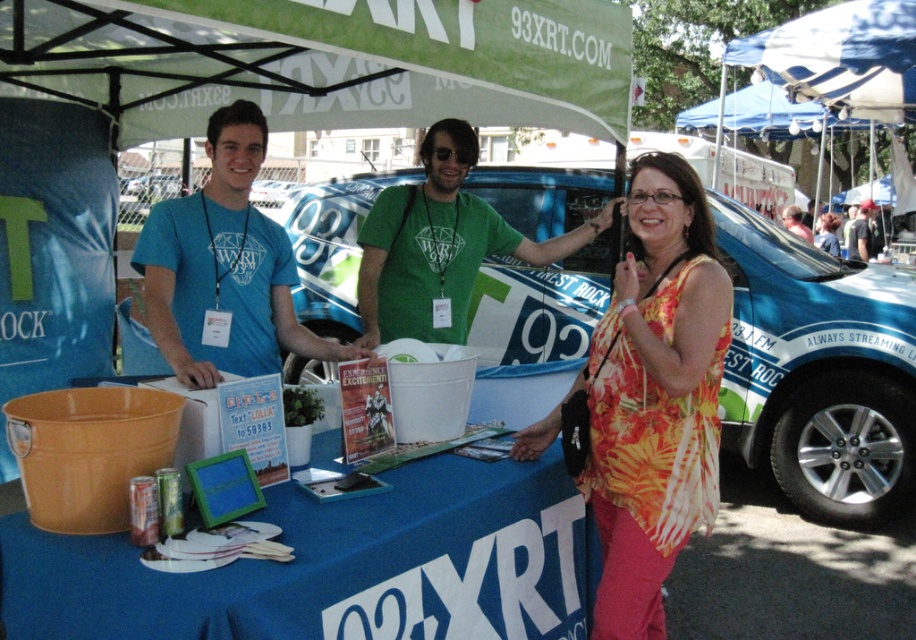
Does blue metallic car at center appear on the left side of matte blue t-shirt at center?

In fact, blue metallic car at center is to the right of matte blue t-shirt at center.

Does blue metallic car at center have a lesser height compared to matte blue t-shirt at center?

No.

The width and height of the screenshot is (916, 640). In order to click on blue metallic car at center in this screenshot , I will do (x=818, y=371).

Who is shorter, blue metallic car at center or green matte shirt at center?

Standing shorter between the two is green matte shirt at center.

Does blue metallic car at center have a smaller size compared to green matte shirt at center?

Actually, blue metallic car at center might be larger than green matte shirt at center.

Between point (767, 412) and point (494, 227), which one is positioned in front?

Point (494, 227)

Locate an element on the screen. Image resolution: width=916 pixels, height=640 pixels. blue metallic car at center is located at coordinates (818, 371).

Is blue metallic car at center thinner than green fabric canopy at upper center?

Correct, blue metallic car at center's width is less than green fabric canopy at upper center's.

Does blue metallic car at center appear over green fabric canopy at upper center?

No.

Does point (524, 376) come closer to viewer compared to point (356, 17)?

No, (524, 376) is behind (356, 17).

The width and height of the screenshot is (916, 640). I want to click on blue metallic car at center, so click(818, 371).